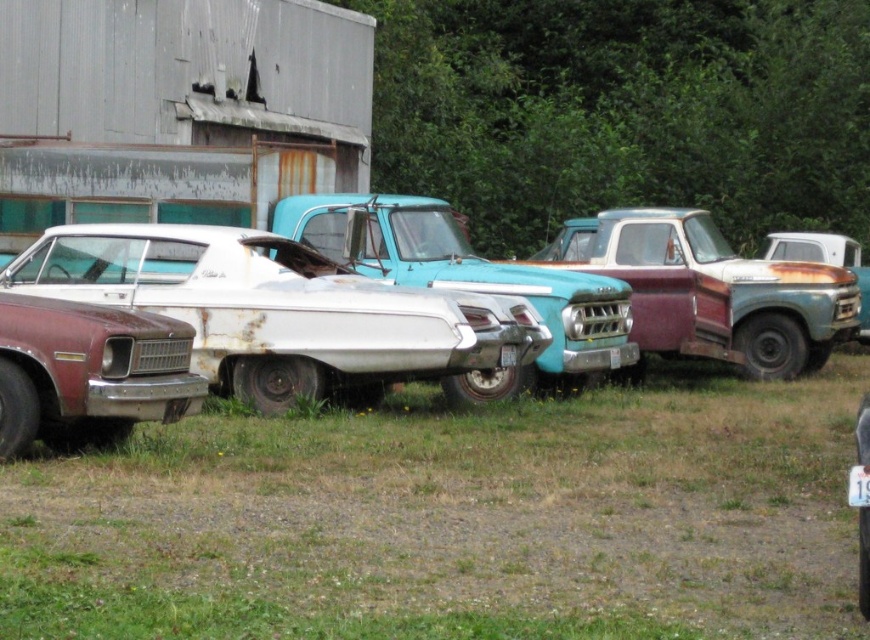
You are a gardener trying to mow the green grass at lower center. The rusty metal pickup truck at center is blocking your path. Can you still mow the grass without moving the truck?

The green grass at lower center is smaller than the rusty metal pickup truck at center, so it might be possible to mow around the truck since the grass area is smaller and not entirely covered by the truck.

You are standing at the edge of the lot and want to walk towards the rusty metal pickup truck at center. Which direction should you walk from the green grass at lower center?

The green grass at lower center is to the left of the rusty metal pickup truck at center, so you should walk to the right to reach the rusty metal pickup truck at center from the green grass at lower center.